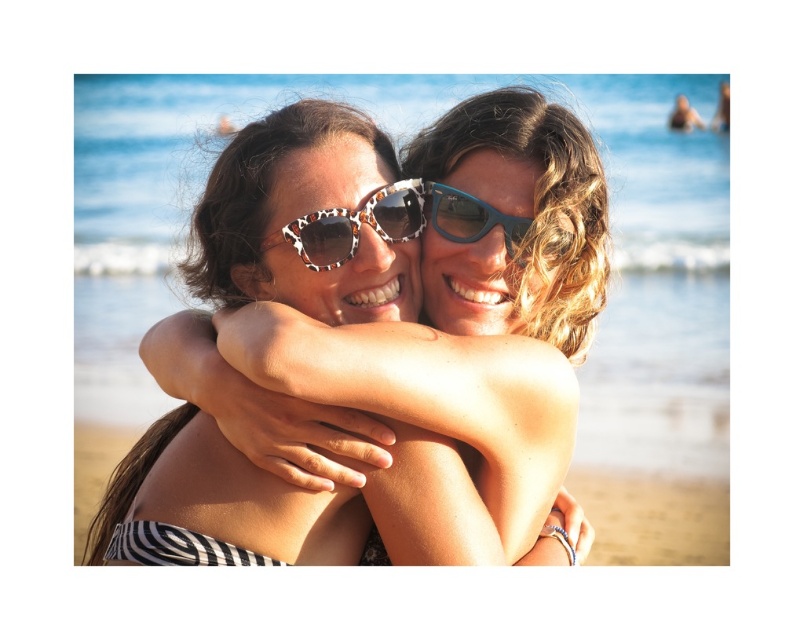
Is sandy tan skin at center positioned before blue plastic goggles at center?

That is False.

Does point (76, 524) lie in front of point (454, 218)?

That is False.

Locate an element on the screen. sandy tan skin at center is located at coordinates (653, 516).

Image resolution: width=804 pixels, height=640 pixels. What do you see at coordinates (302, 211) in the screenshot?
I see `matte black bikini top at center` at bounding box center [302, 211].

You are a GUI agent. You are given a task and a screenshot of the screen. Output one action in this format:
    pyautogui.click(x=<x>, y=<y>)
    Task: Click on the matte black bikini top at center
    
    Given the screenshot: What is the action you would take?
    pyautogui.click(x=302, y=211)

Which is in front, point (628, 516) or point (310, 216)?

Point (310, 216) is in front.

Is sandy tan skin at center above leopard print acetate sunglasses at center?

No.

Measure the distance between point (96, 496) and camera.

Point (96, 496) and camera are 38.54 meters apart from each other.

Image resolution: width=804 pixels, height=640 pixels. In order to click on sandy tan skin at center in this screenshot , I will do `click(653, 516)`.